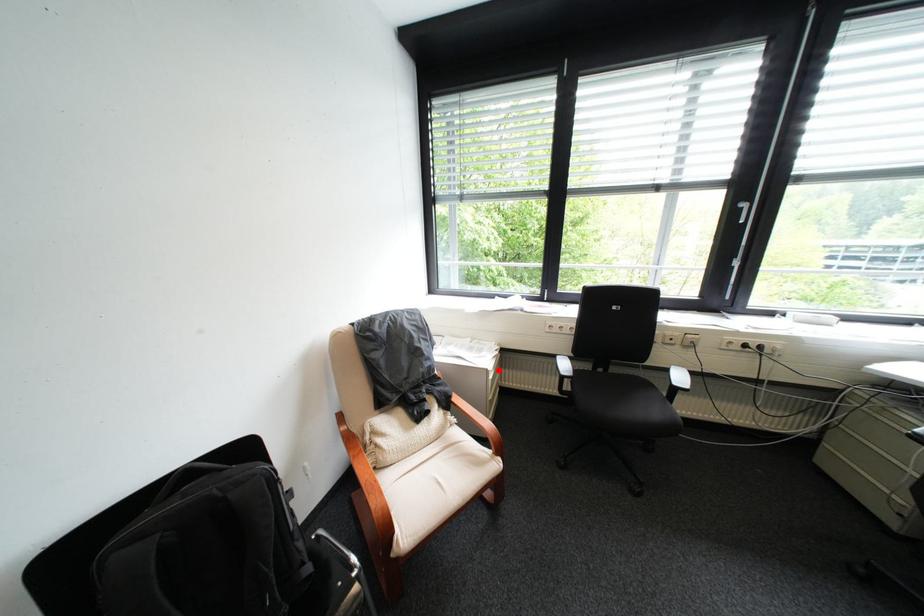
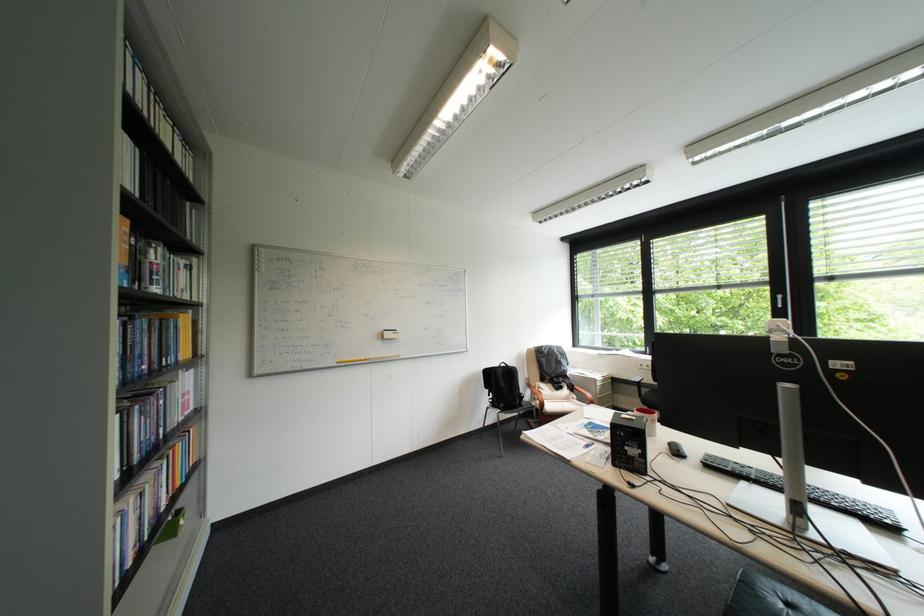
The point at the highlighted location is marked in the first image. Where is the corresponding point in the second image?

(608, 379)